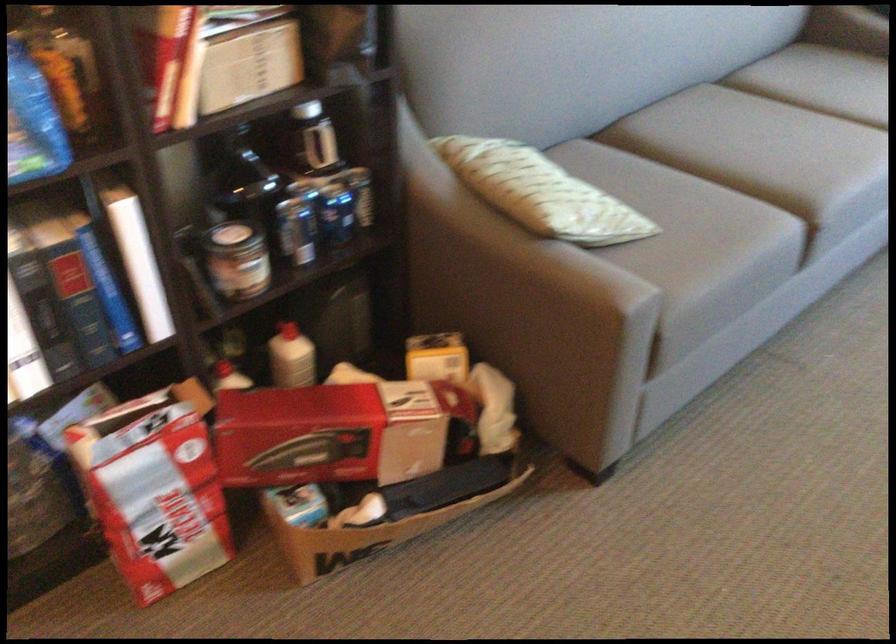
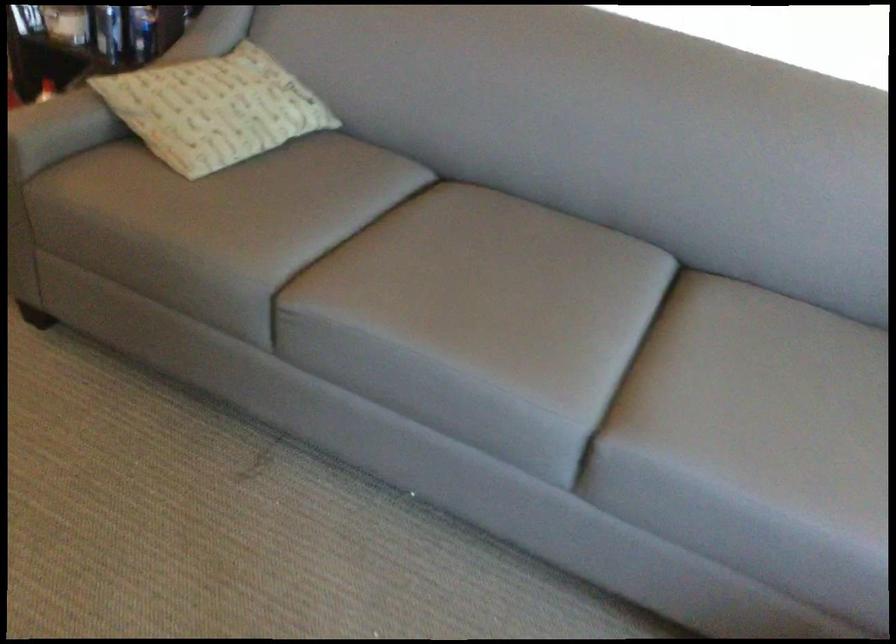
In the second image, find the point that corresponds to (780,142) in the first image.

(479, 290)